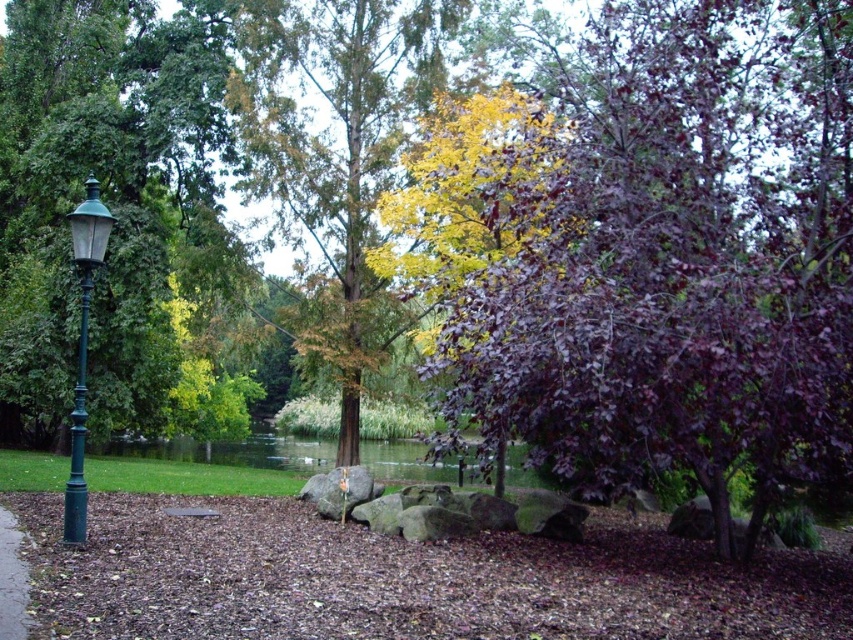
Question: Which of the following is the farthest from the observer?

Choices:
 (A) (668, 20)
 (B) (80, 333)
 (C) (0, 592)

Answer: (A)

Question: Is green metal lamp post at left closer to the viewer compared to brown gravel path at lower left?

Choices:
 (A) yes
 (B) no

Answer: (B)

Question: Which of the following is the farthest from the observer?

Choices:
 (A) (79, 449)
 (B) (10, 528)
 (C) (413, 444)
 (D) (80, 528)

Answer: (C)

Question: Which object appears closest to the camera in this image?

Choices:
 (A) green polished metal pole at left
 (B) green grassy lake at center

Answer: (A)

Question: From the image, what is the correct spatial relationship of green metal lamp post at left in relation to brown gravel path at lower left?

Choices:
 (A) right
 (B) left

Answer: (B)

Question: Is green polished metal pole at left bigger than brown gravel path at lower left?

Choices:
 (A) yes
 (B) no

Answer: (A)